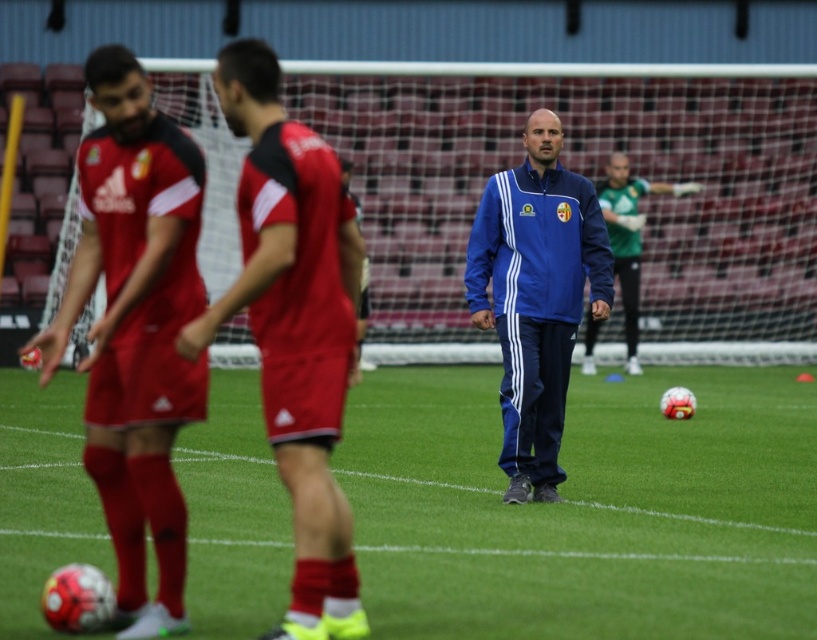
The width and height of the screenshot is (817, 640). I want to click on matte red soccer uniform at left, so click(x=136, y=328).

Is matte red soccer uniform at left further to camera compared to blue fabric jacket at center?

No.

Locate an element on the screen. matte red soccer uniform at left is located at coordinates (136, 328).

Where is `matte red soccer uniform at left`? The height and width of the screenshot is (640, 817). matte red soccer uniform at left is located at coordinates tap(136, 328).

Does green grass at center have a smaller size compared to red jersey at center?

No.

Is point (735, 444) closer to camera compared to point (212, 330)?

That is False.

Image resolution: width=817 pixels, height=640 pixels. I want to click on green grass at center, so click(586, 508).

Which is above, matte red soccer uniform at left or red jersey at center?

red jersey at center

Who is lower down, matte red soccer uniform at left or red jersey at center?

matte red soccer uniform at left

Between point (144, 515) and point (264, 342), which one is positioned behind?

Point (144, 515)

Find the location of `matte red soccer uniform at left`. matte red soccer uniform at left is located at coordinates (136, 328).